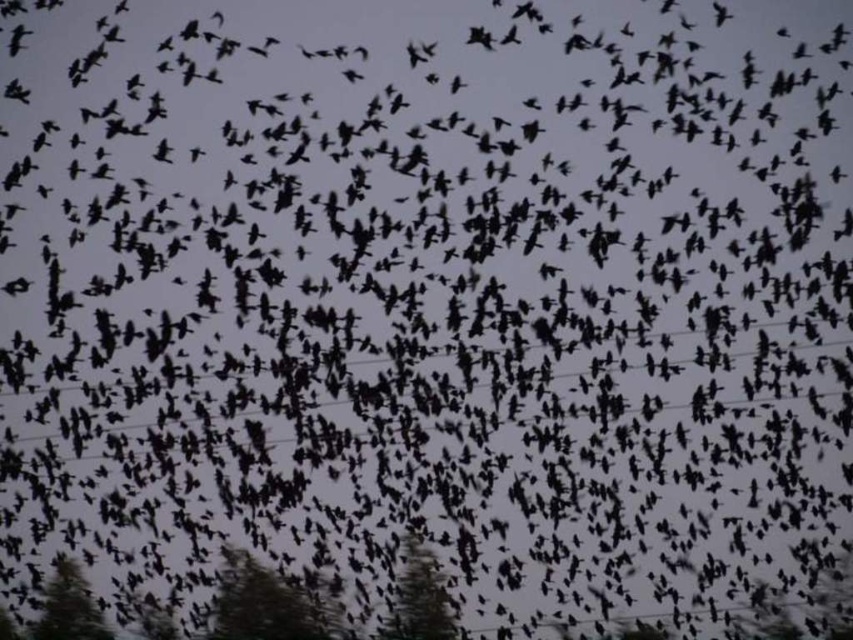
You are a bird flying in the flock and want to land on a tree. Which tree, the green textured tree at center or the green matte tree at lower left, is wider and thus safer to land on?

The green matte tree at lower left is wider than the green textured tree at center, so it is safer to land on the green matte tree at lower left.